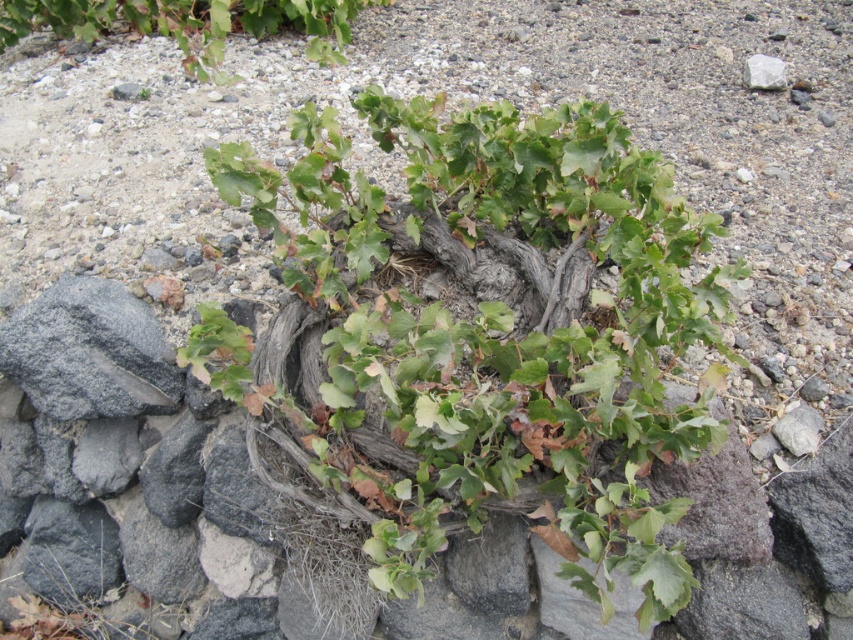
You are a hiker who wants to take a photo of the white smooth rock at upper right without the green leafy plant at upper center blocking it. What should you do?

Move to a position where you can see the white smooth rock at upper right behind the green leafy plant at upper center, as the white smooth rock at upper right is located behind the plant.

You are standing at the base of the plant and want to place a small marker at point (599, 109) and another at point (763, 84). Which marker will be closer to you when viewed from your current position?

Point (599, 109) is in front of point (763, 84), so the marker at point (599, 109) will be closer to you.

You are a hiker who wants to take a photo of both the green leafy plant at center and the green leafy plant at upper center. Which plant should you focus on first if you want to capture them in order from left to right?

The green leafy plant at upper center should be focused on first because it is positioned to the left of the green leafy plant at center.